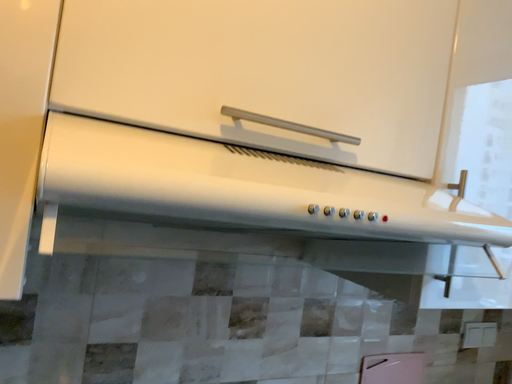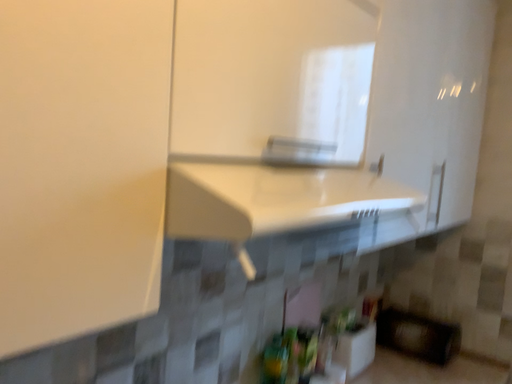
Question: How did the camera likely rotate when shooting the video?

Choices:
 (A) rotated upward
 (B) rotated downward

Answer: (B)